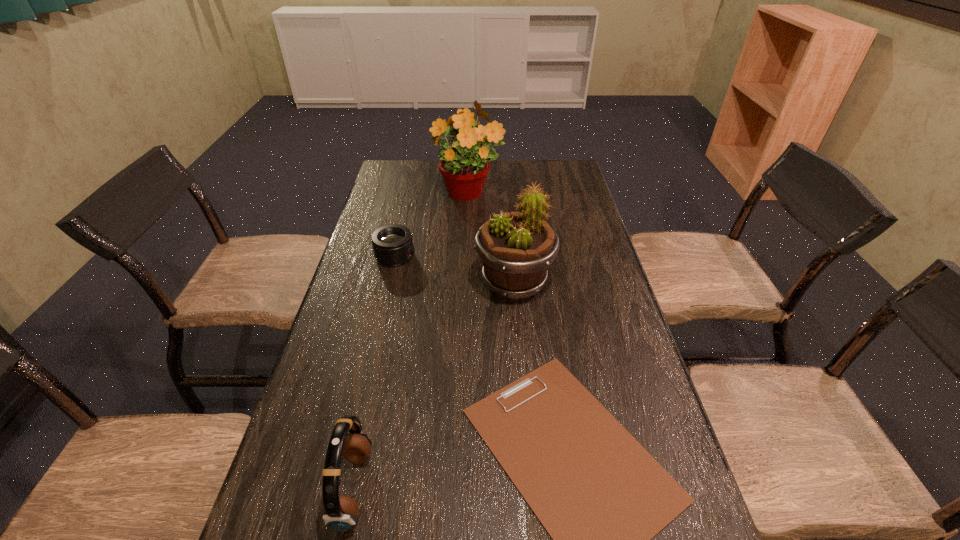
Locate an element on the screen. The image size is (960, 540). the farthest object is located at coordinates (464, 165).

The image size is (960, 540). Identify the location of the nearer flowerpot. (516, 249).

The width and height of the screenshot is (960, 540). In order to click on the third tallest object in this screenshot , I will do `click(348, 439)`.

I want to click on telephoto lens, so 392,244.

The image size is (960, 540). Find the location of `free location located on the back of the farthest object`. free location located on the back of the farthest object is located at coordinates (469, 168).

Locate an element on the screen. This screenshot has height=540, width=960. free location located 0.120m on the left of the nearer flowerpot is located at coordinates (432, 283).

The height and width of the screenshot is (540, 960). I want to click on vacant space positioned on the ear cup of the headset, so click(492, 488).

The height and width of the screenshot is (540, 960). I want to click on vacant position located on the side of the telephoto lens with brand markings and control switches, so click(x=448, y=256).

Identify the location of object that is at the far edge. (464, 165).

Where is `headset located at the left edge`? The height and width of the screenshot is (540, 960). headset located at the left edge is located at coordinates (348, 439).